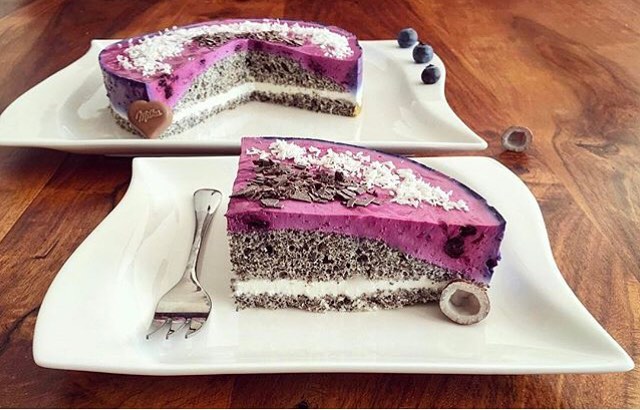
Where is `wooden talbe`? Image resolution: width=640 pixels, height=410 pixels. wooden talbe is located at coordinates (559, 184).